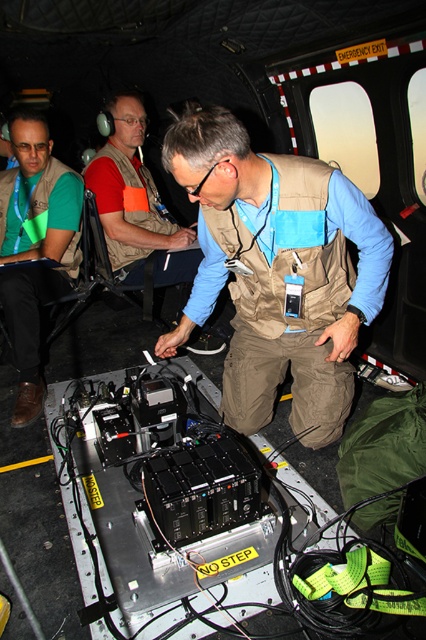
Question: Is tan fabric vest at center bigger than matte green vest at lower left?

Choices:
 (A) no
 (B) yes

Answer: (B)

Question: Which point appears farthest from the camera in this image?

Choices:
 (A) (138, 228)
 (B) (23, 278)
 (C) (305, 422)

Answer: (A)

Question: Which point is closer to the camera taking this photo?

Choices:
 (A) (20, 348)
 (B) (163, 144)
 (C) (183, 232)

Answer: (A)

Question: Can you confirm if tan fabric vest at center is positioned below matte brown vest at center?

Choices:
 (A) no
 (B) yes

Answer: (B)

Question: Which of the following is the closest to the observer?

Choices:
 (A) (37, 394)
 (B) (134, 284)

Answer: (A)

Question: Does matte green vest at lower left have a lesser width compared to matte brown vest at center?

Choices:
 (A) no
 (B) yes

Answer: (B)